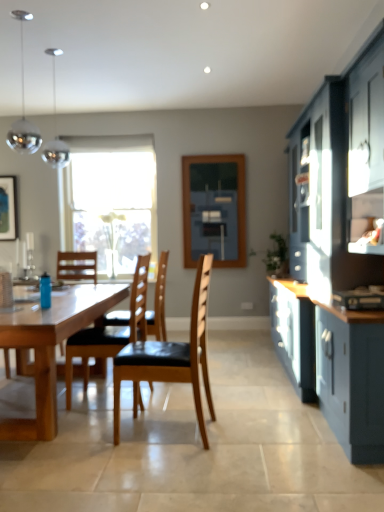
This screenshot has height=512, width=384. Identify the location of vacant space that is to the left of brown leather chair at center, positioned as the 3th chair in back-to-front order. (86, 437).